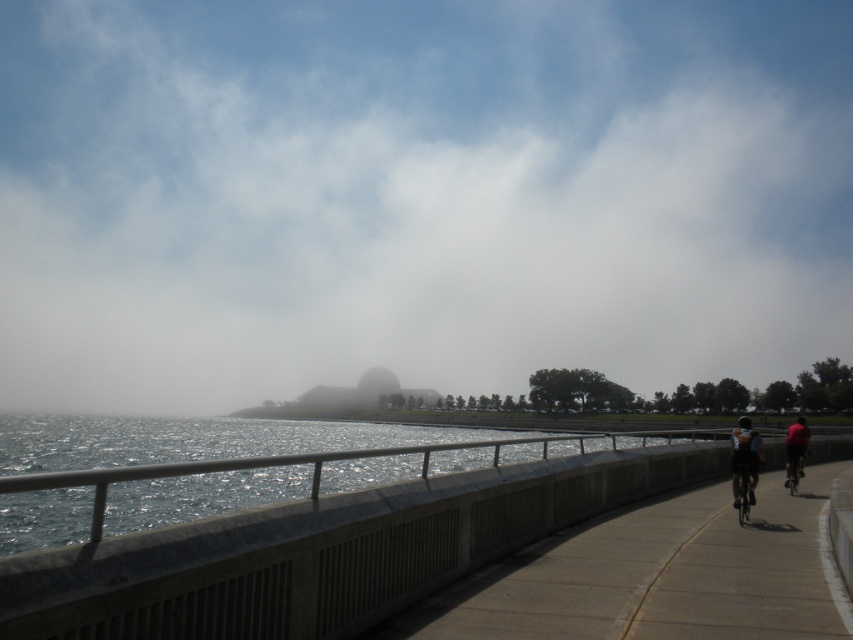
Question: Considering the real-world distances, which object is farthest from the concrete sidewalk at center?

Choices:
 (A) dark blue fabric cyclist at right
 (B) foggy atmosphere at upper center

Answer: (B)

Question: Is dark blue fabric cyclist at right to the left of metallic silver bicycle at right from the viewer's perspective?

Choices:
 (A) yes
 (B) no

Answer: (B)

Question: Which object is positioned farthest from the black matte bicycle at center-right?

Choices:
 (A) metallic silver bicycle at right
 (B) dark red fabric cyclist at right
 (C) foggy atmosphere at upper center
 (D) dark blue fabric cyclist at right

Answer: (C)

Question: Does foggy atmosphere at upper center appear on the left side of dark blue fabric cyclist at right?

Choices:
 (A) no
 (B) yes

Answer: (B)

Question: Is concrete sidewalk at center smaller than dark blue fabric cyclist at right?

Choices:
 (A) yes
 (B) no

Answer: (A)

Question: Which of these objects is positioned farthest from the foggy atmosphere at upper center?

Choices:
 (A) concrete sidewalk at center
 (B) black matte bicycle at center-right
 (C) dark red fabric cyclist at right
 (D) dark blue fabric cyclist at right

Answer: (B)